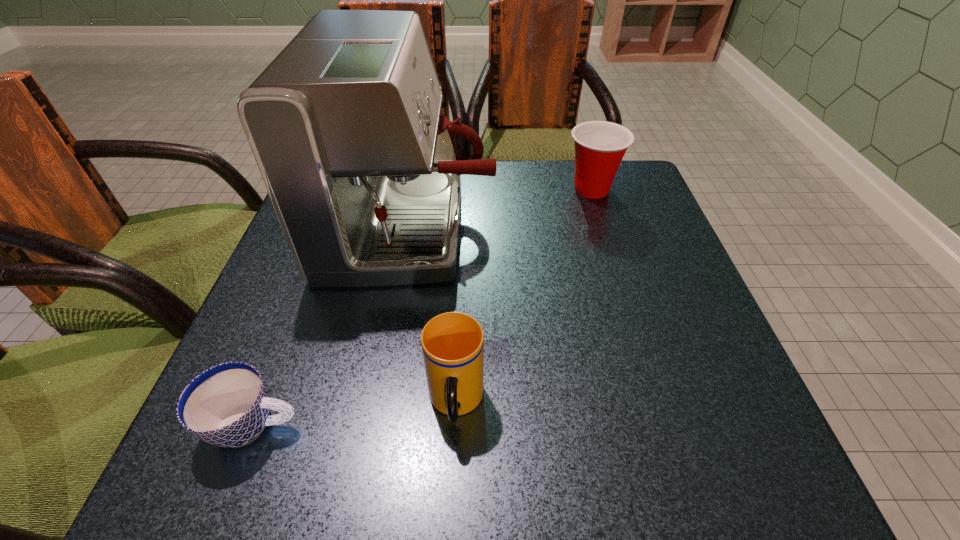
Image resolution: width=960 pixels, height=540 pixels. I want to click on free space between the rightmost object and the second cup from left to right, so click(x=524, y=296).

Image resolution: width=960 pixels, height=540 pixels. In order to click on vacant space in between the second cup from left to right and the shortest object in this screenshot , I will do `click(355, 414)`.

The width and height of the screenshot is (960, 540). Find the location of `free space between the second cup from left to right and the shortest cup`. free space between the second cup from left to right and the shortest cup is located at coordinates (355, 414).

Locate an element on the screen. free spot between the second cup from left to right and the farthest cup is located at coordinates (524, 296).

Image resolution: width=960 pixels, height=540 pixels. Identify the location of the third closest object to the farthest cup. (227, 405).

Where is `object that is the third closest to the coffee maker`? The image size is (960, 540). object that is the third closest to the coffee maker is located at coordinates (227, 405).

Select which cup is the closest to the second cup from right to left. Please provide its 2D coordinates. Your answer should be formatted as a tuple, i.e. [(x, y)], where the tuple contains the x and y coordinates of a point satisfying the conditions above.

[(227, 405)]

Identify which cup is the second closest to the rightmost cup. Please provide its 2D coordinates. Your answer should be formatted as a tuple, i.e. [(x, y)], where the tuple contains the x and y coordinates of a point satisfying the conditions above.

[(227, 405)]

You are a GUI agent. You are given a task and a screenshot of the screen. Output one action in this format:
    pyautogui.click(x=<x>, y=<y>)
    Task: Click on the free location that satisfies the following two spatial constraints: 1. on the side of the second cup from right to left with the handle; 2. on the side of the shortest object with the handle
    The width and height of the screenshot is (960, 540).
    Given the screenshot: What is the action you would take?
    pyautogui.click(x=455, y=425)

The image size is (960, 540). I want to click on vacant space that satisfies the following two spatial constraints: 1. on the side of the second cup from right to left with the handle; 2. on the side of the leftmost cup with the handle, so click(455, 425).